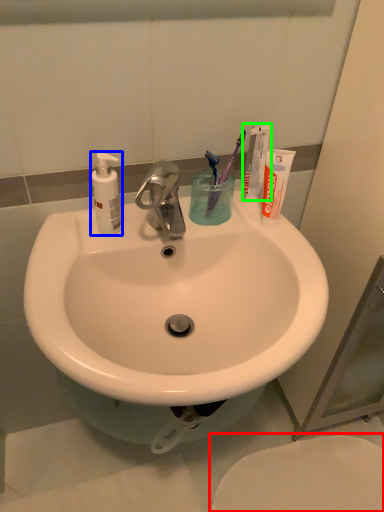
Question: Based on their relative distances, which object is nearer to toilet (highlighted by a red box)? Choose from soap dispenser (highlighted by a blue box) and toothpaste (highlighted by a green box).

Choices:
 (A) soap dispenser
 (B) toothpaste

Answer: (B)